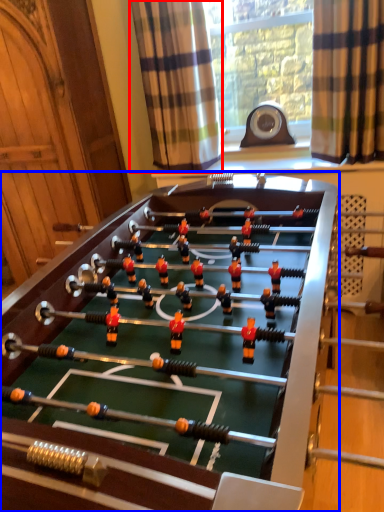
Question: Which object is further to the camera taking this photo, curtain (highlighted by a red box) or table (highlighted by a blue box)?

Choices:
 (A) curtain
 (B) table

Answer: (A)